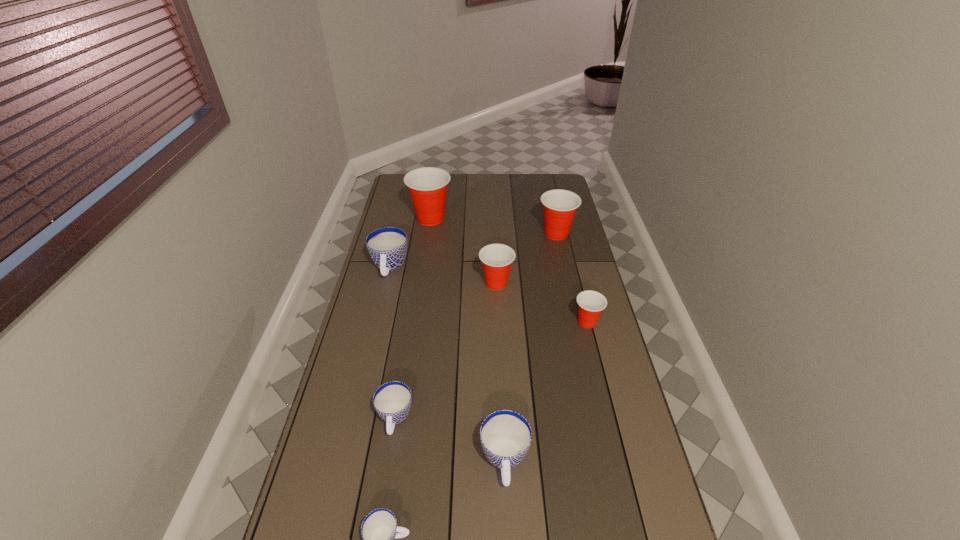
Where is `the tallest object`? The image size is (960, 540). the tallest object is located at coordinates (427, 186).

Locate an element on the screen. Image resolution: width=960 pixels, height=540 pixels. the biggest red cup is located at coordinates point(427,186).

Find the location of a particular element. the second tallest cup is located at coordinates (560, 206).

You are a GUI agent. You are given a task and a screenshot of the screen. Output one action in this format:
    pyautogui.click(x=<x>, y=<y>)
    Task: Click on the second tallest object
    This screenshot has width=960, height=540.
    Given the screenshot: What is the action you would take?
    pyautogui.click(x=560, y=206)

Image resolution: width=960 pixels, height=540 pixels. In order to click on the second red cup from left to right in this screenshot , I will do `click(496, 258)`.

This screenshot has width=960, height=540. I want to click on the second nearest red cup, so click(x=496, y=258).

The height and width of the screenshot is (540, 960). I want to click on the farthest blue cup, so click(x=387, y=246).

In order to click on the second biggest blue cup in this screenshot , I will do `click(505, 435)`.

Where is `the smallest red cup`? the smallest red cup is located at coordinates (590, 303).

The height and width of the screenshot is (540, 960). I want to click on the fourth nearest object, so click(590, 303).